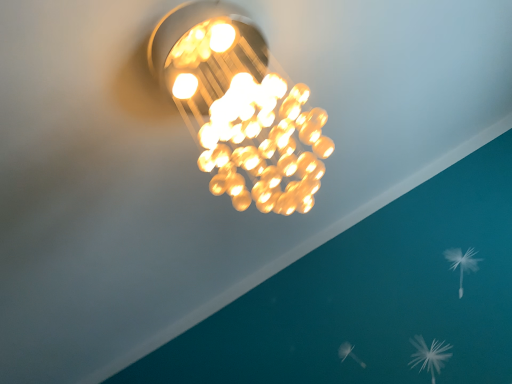
Find the location of a particular element. This screenshot has height=384, width=512. matte gold chandelier at upper center is located at coordinates (240, 107).

Measure the distance between matte gold chandelier at upper center and camera.

matte gold chandelier at upper center and camera are 25.32 inches apart from each other.

This screenshot has height=384, width=512. What do you see at coordinates (240, 107) in the screenshot?
I see `matte gold chandelier at upper center` at bounding box center [240, 107].

In order to click on matte gold chandelier at upper center in this screenshot , I will do `click(240, 107)`.